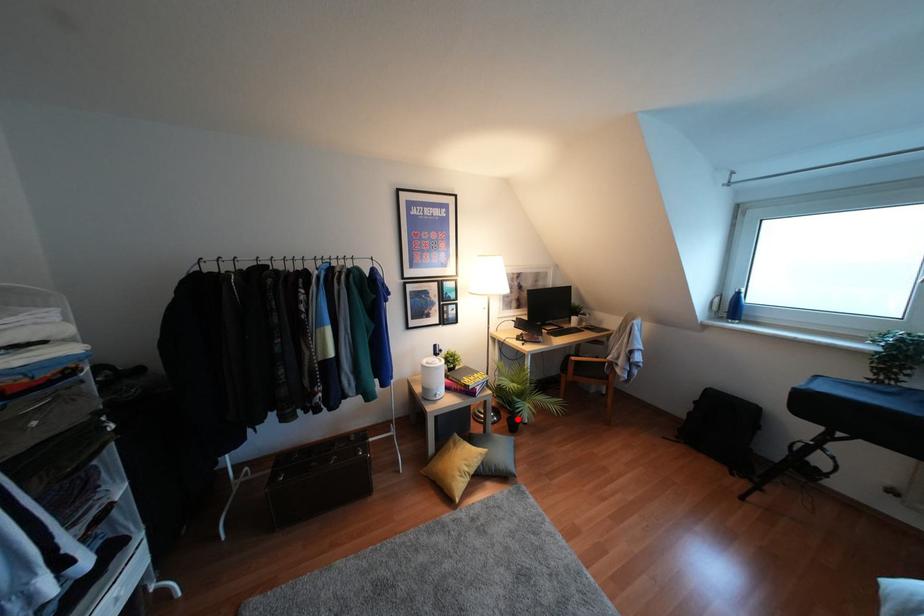
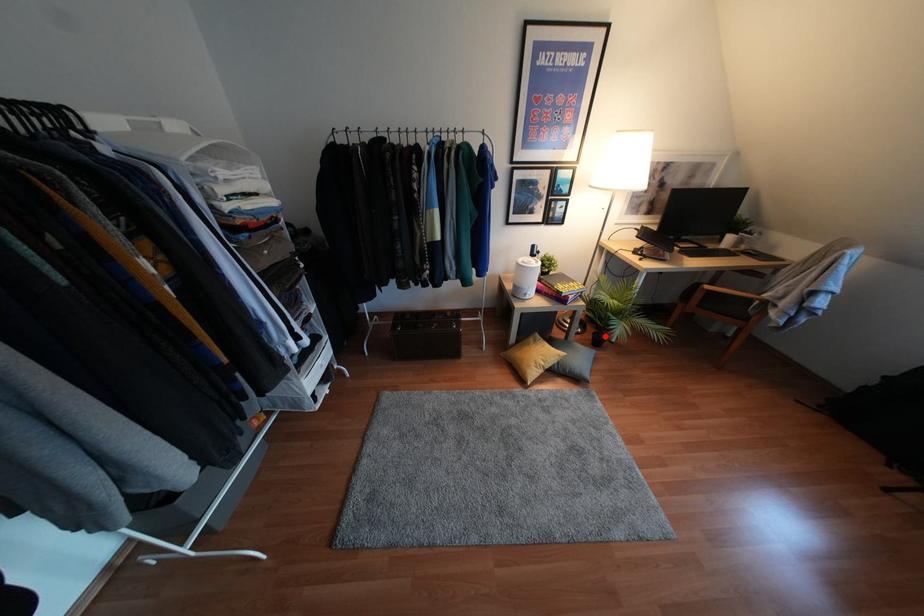
I am providing you with two images of the same scene from different viewpoints. A red point is marked on the first image and another point is marked on the second image. Do the highlighted points in image1 and image2 indicate the same real-world spot?

Yes